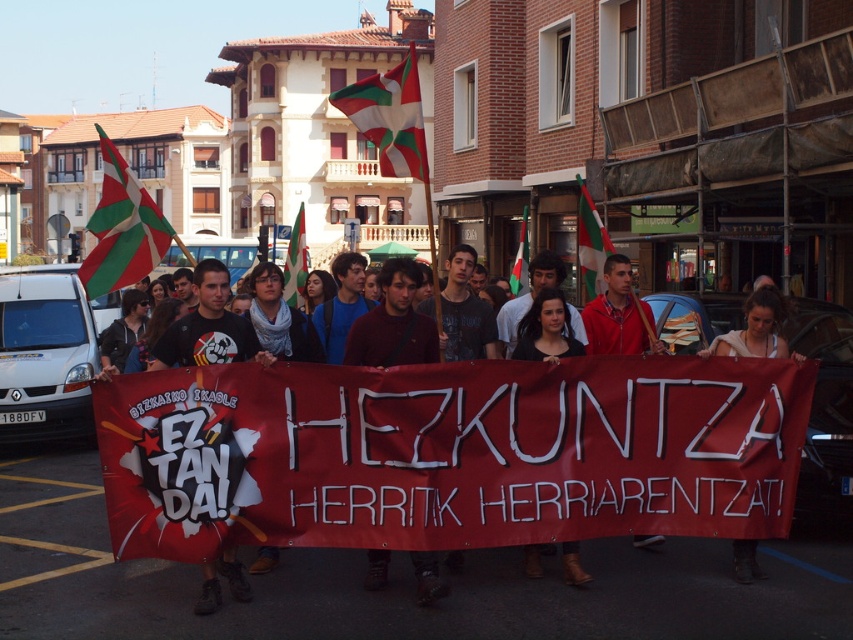
Looking at this image, you are a photographer at the protest and want to capture both the green and white striped flag at center and the green and white fabric flag at center in a single shot. Which flag should you focus on first to ensure both are in frame?

The green and white striped flag at center is located below the green and white fabric flag at center, so focusing on the higher positioned green and white fabric flag at center first would allow you to frame both flags within the shot.